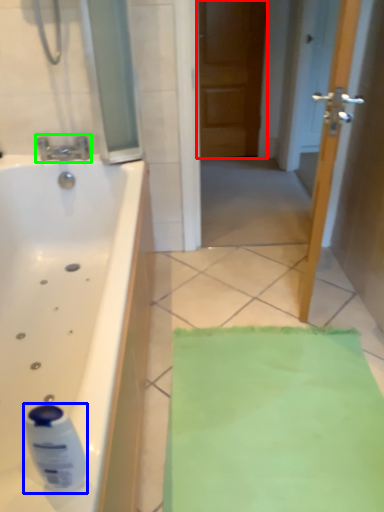
Question: Based on their relative distances, which object is nearer to door (highlighted by a red box)? Choose from cleaning product (highlighted by a blue box) and tap (highlighted by a green box).

Choices:
 (A) cleaning product
 (B) tap

Answer: (B)